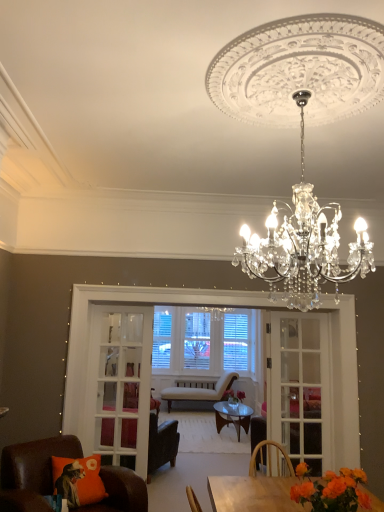
Question: From the image's perspective, is light beige fabric chair at center, the third chair in the front-to-back sequence, on top of white glass screen door at center, which is the first screen door from right to left?

Choices:
 (A) yes
 (B) no

Answer: (B)

Question: Is light beige fabric chair at center, arranged as the first chair when viewed from the back, shorter than white glass screen door at center, which is the second screen door from left to right?

Choices:
 (A) yes
 (B) no

Answer: (A)

Question: Is light beige fabric chair at center, arranged as the first chair when viewed from the back, further to camera compared to white glass screen door at center, which is the first screen door from right to left?

Choices:
 (A) no
 (B) yes

Answer: (B)

Question: From a real-world perspective, is light beige fabric chair at center, the third chair in the front-to-back sequence, under white glass screen door at center, which is the first screen door from right to left?

Choices:
 (A) yes
 (B) no

Answer: (A)

Question: Is light beige fabric chair at center, the third chair in the front-to-back sequence, closer to the viewer compared to white glass screen door at center, which is the second screen door from left to right?

Choices:
 (A) no
 (B) yes

Answer: (A)

Question: From a real-world perspective, does light beige fabric chair at center, arranged as the first chair when viewed from the back, stand above white glass screen door at center, which is the second screen door from left to right?

Choices:
 (A) no
 (B) yes

Answer: (A)

Question: From the image's perspective, is orange matte flower at lower right, acting as the 2th flower starting from the back, beneath orange fabric pillow at lower left?

Choices:
 (A) yes
 (B) no

Answer: (B)

Question: Is orange matte flower at lower right, the 1th flower in the front-to-back sequence, oriented away from orange fabric pillow at lower left?

Choices:
 (A) yes
 (B) no

Answer: (B)

Question: Is orange matte flower at lower right, the second flower from the bottom, facing towards orange fabric pillow at lower left?

Choices:
 (A) yes
 (B) no

Answer: (B)

Question: Can you confirm if orange matte flower at lower right, acting as the first flower starting from the top, is wider than orange fabric pillow at lower left?

Choices:
 (A) no
 (B) yes

Answer: (A)

Question: Is orange matte flower at lower right, the 1th flower in the front-to-back sequence, in contact with orange fabric pillow at lower left?

Choices:
 (A) yes
 (B) no

Answer: (B)

Question: Is there a large distance between orange matte flower at lower right, acting as the 2th flower starting from the back, and orange fabric pillow at lower left?

Choices:
 (A) no
 (B) yes

Answer: (B)

Question: Is leather armchair at center, the second chair from the front, oriented towards pink matte vase at center, arranged as the 2th flower when viewed from the top?

Choices:
 (A) no
 (B) yes

Answer: (B)